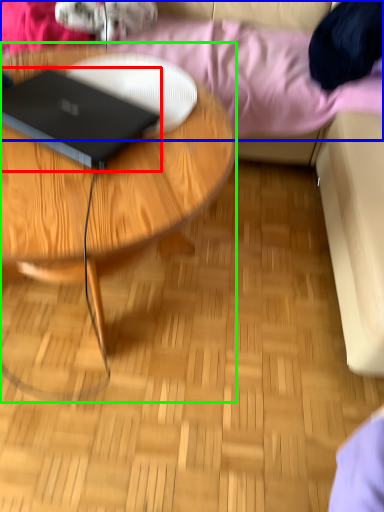
Question: Which is nearer to the laptop (highlighted by a red box)? bedding (highlighted by a blue box) or coffee table (highlighted by a green box).

Choices:
 (A) bedding
 (B) coffee table

Answer: (B)